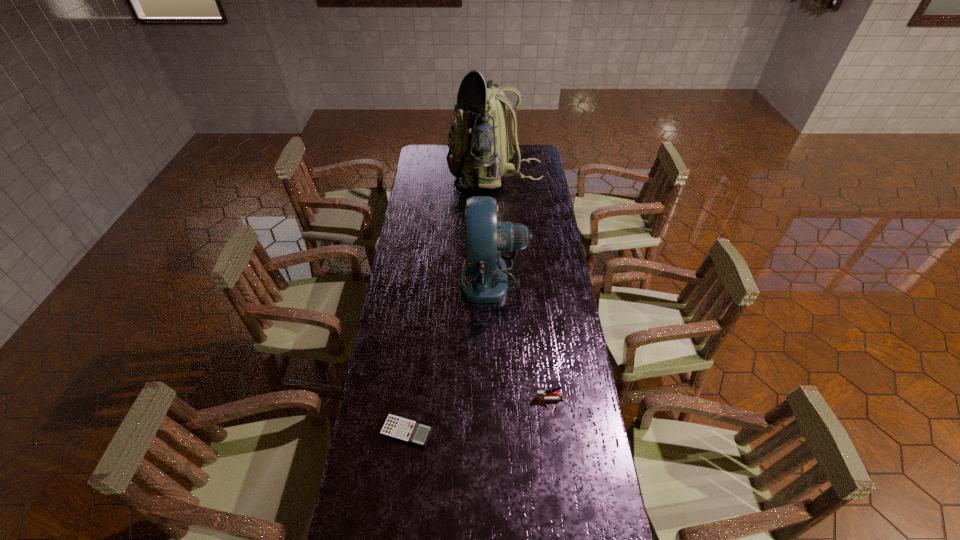
You are a GUI agent. You are given a task and a screenshot of the screen. Output one action in this format:
    pyautogui.click(x=<x>, y=<y>)
    Task: Click on the backpack
    
    Given the screenshot: What is the action you would take?
    pyautogui.click(x=479, y=152)

The height and width of the screenshot is (540, 960). I want to click on the farthest object, so click(x=479, y=152).

What are the coordinates of `the third nearest object` in the screenshot? It's located at (484, 279).

Where is `fan`? fan is located at coordinates (484, 279).

Where is `the second nearest object`? The height and width of the screenshot is (540, 960). the second nearest object is located at coordinates (541, 395).

Find the location of a particular element. the third tallest object is located at coordinates (541, 395).

Where is `calculator`? This screenshot has height=540, width=960. calculator is located at coordinates (416, 433).

Find the location of a particular element. This screenshot has height=540, width=960. the nearest object is located at coordinates (416, 433).

This screenshot has width=960, height=540. In order to click on vacant area situated 0.130m on the front-facing side of the backpack in this screenshot , I will do `click(423, 178)`.

I want to click on free location located 0.100m on the front-facing side of the backpack, so click(429, 178).